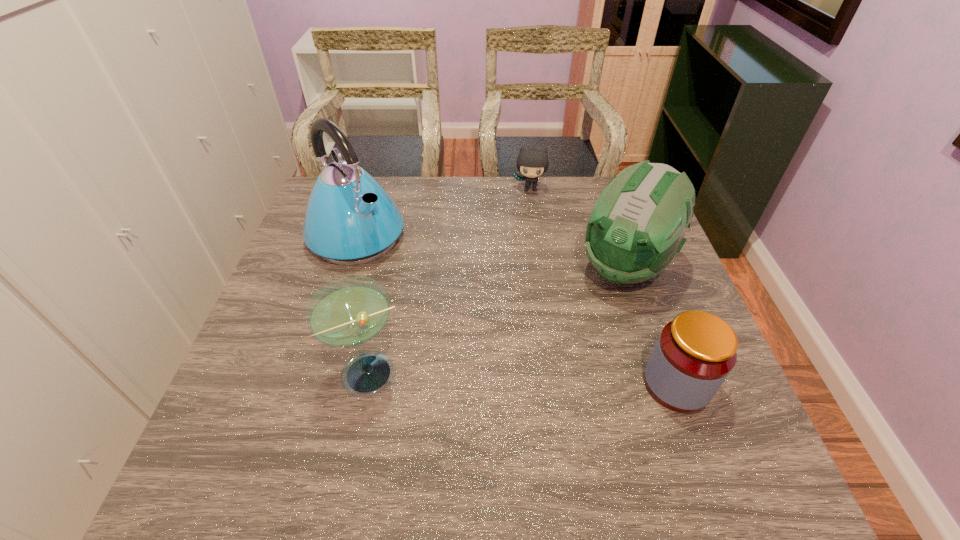
The image size is (960, 540). Find the location of `vacant point located between the second shortest object and the kettle`. vacant point located between the second shortest object and the kettle is located at coordinates (516, 310).

Identify the location of object that is the fourth closest to the farthest object. (348, 312).

Locate which object is the third closest to the shortest object. Please provide its 2D coordinates. Your answer should be formatted as a tuple, i.e. [(x, y)], where the tuple contains the x and y coordinates of a point satisfying the conditions above.

[(694, 354)]

This screenshot has height=540, width=960. I want to click on vacant region that satisfies the following two spatial constraints: 1. on the back side of the shortest object; 2. on the right side of the kettle, so click(x=372, y=189).

The height and width of the screenshot is (540, 960). Identify the location of vacant position in the image that satisfies the following two spatial constraints: 1. on the front side of the fourth tallest object; 2. on the right side of the fourth shortest object. (665, 384).

The image size is (960, 540). I want to click on vacant region that satisfies the following two spatial constraints: 1. on the back side of the kettle; 2. on the right side of the farthest object, so click(x=372, y=189).

Locate an element on the screen. The image size is (960, 540). free space that satisfies the following two spatial constraints: 1. on the back side of the third shortest object; 2. on the right side of the football helmet is located at coordinates (393, 267).

You are a GUI agent. You are given a task and a screenshot of the screen. Output one action in this format:
    pyautogui.click(x=<x>, y=<y>)
    Task: Click on the vacant region that satisfies the following two spatial constraints: 1. on the front side of the martini; 2. on the left side of the jar
    
    Given the screenshot: What is the action you would take?
    pyautogui.click(x=370, y=384)

At what (x,y) coordinates should I click in order to perform the action: click on vacant region that satisfies the following two spatial constraints: 1. on the back side of the farthest object; 2. on the right side of the kettle. Please return your answer as a coordinate pair (x, y). Looking at the image, I should click on (372, 189).

This screenshot has width=960, height=540. Identify the location of vacant space that satisfies the following two spatial constraints: 1. on the front side of the third shortest object; 2. on the left side of the fourth tallest object. coord(370,384).